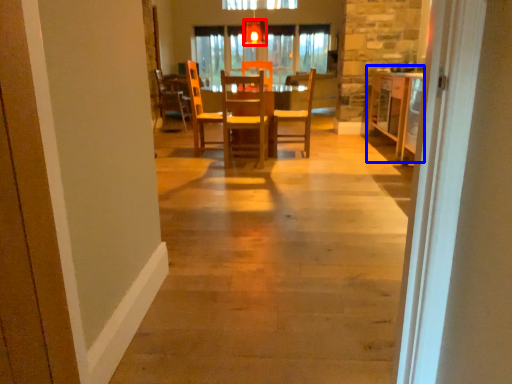
Question: Among these objects, which one is farthest to the camera, light fixture (highlighted by a red box) or table (highlighted by a blue box)?

Choices:
 (A) light fixture
 (B) table

Answer: (A)